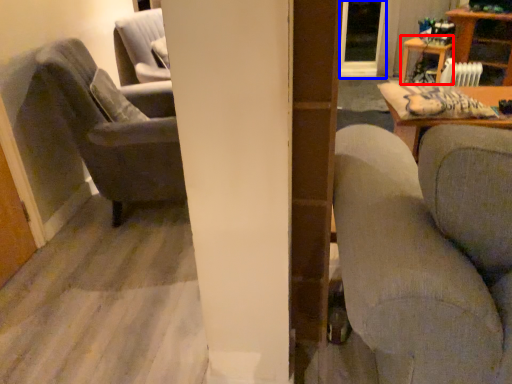
Question: Which point is further to the camera, table (highlighted by a red box) or glass door (highlighted by a blue box)?

Choices:
 (A) table
 (B) glass door

Answer: (B)